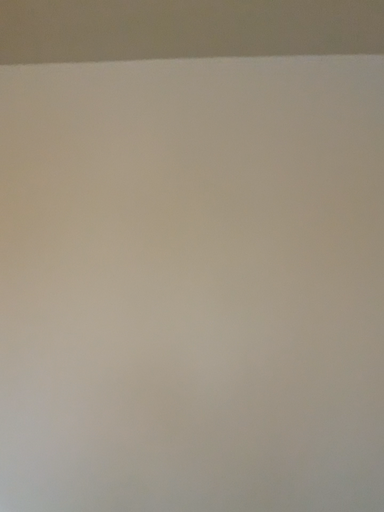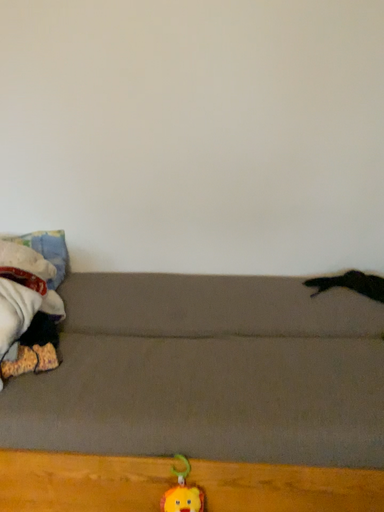
Question: Which way did the camera rotate in the video?

Choices:
 (A) rotated upward
 (B) rotated downward

Answer: (B)